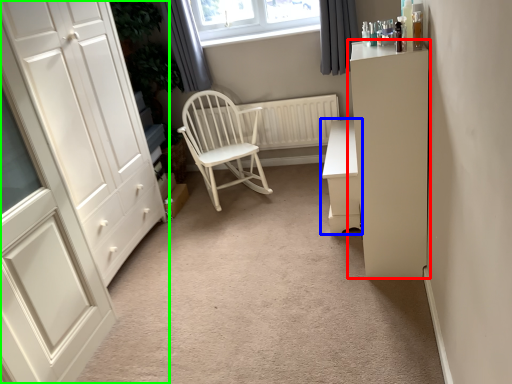
Question: Based on their relative distances, which object is farther from cabinetry (highlighted by a red box)? Choose from chest of drawers (highlighted by a blue box) and cupboard (highlighted by a green box).

Choices:
 (A) chest of drawers
 (B) cupboard

Answer: (B)